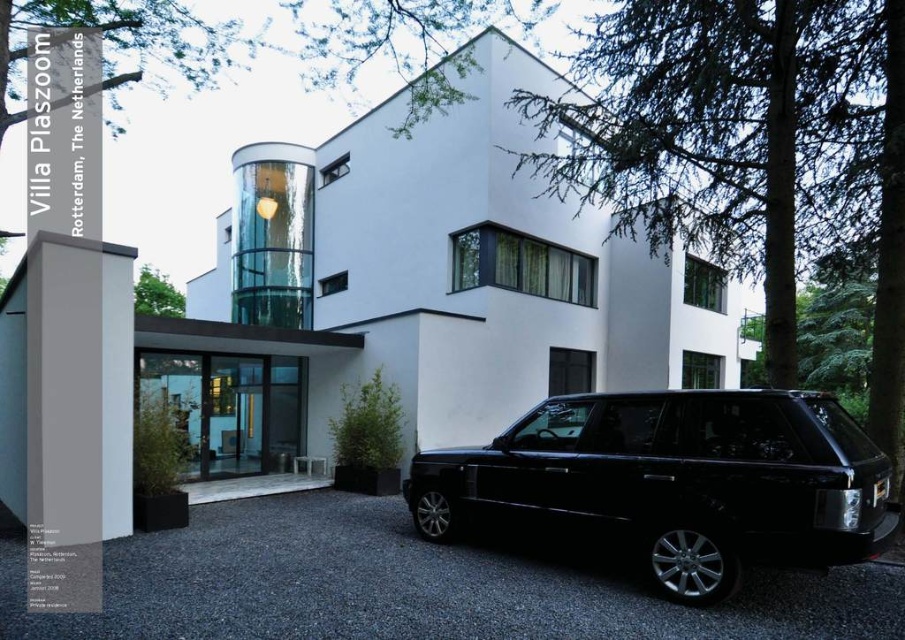
Is black asphalt driveway at lower center above black glossy suv at center?

No, black asphalt driveway at lower center is not above black glossy suv at center.

Which is more to the right, black asphalt driveway at lower center or black glossy suv at center?

black glossy suv at center

Describe the element at coordinates (415, 586) in the screenshot. Image resolution: width=905 pixels, height=640 pixels. I see `black asphalt driveway at lower center` at that location.

You are a GUI agent. You are given a task and a screenshot of the screen. Output one action in this format:
    pyautogui.click(x=<x>, y=<y>)
    Task: Click on the black asphalt driveway at lower center
    This screenshot has height=640, width=905.
    Given the screenshot: What is the action you would take?
    pyautogui.click(x=415, y=586)